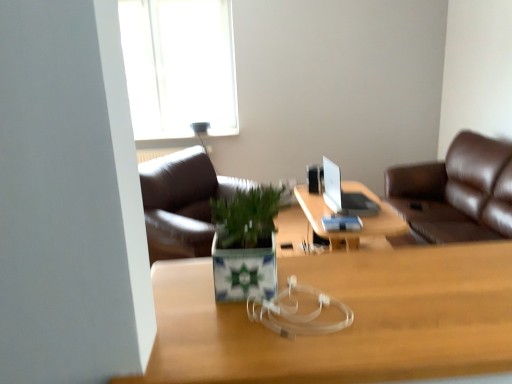
Question: Is wooden desk at center at the right side of green ceramic pot at center?

Choices:
 (A) no
 (B) yes

Answer: (B)

Question: Considering the relative sizes of wooden desk at center and green ceramic pot at center in the image provided, is wooden desk at center taller than green ceramic pot at center?

Choices:
 (A) yes
 (B) no

Answer: (B)

Question: From a real-world perspective, is wooden desk at center over green ceramic pot at center?

Choices:
 (A) no
 (B) yes

Answer: (A)

Question: Is wooden desk at center not inside green ceramic pot at center?

Choices:
 (A) yes
 (B) no

Answer: (A)

Question: Does wooden desk at center have a greater width compared to green ceramic pot at center?

Choices:
 (A) no
 (B) yes

Answer: (B)

Question: Does wooden desk at center have a lesser width compared to green ceramic pot at center?

Choices:
 (A) yes
 (B) no

Answer: (B)

Question: Is green ceramic pot at center touching wooden table at center?

Choices:
 (A) no
 (B) yes

Answer: (A)

Question: Is green ceramic pot at center located outside wooden table at center?

Choices:
 (A) no
 (B) yes

Answer: (B)

Question: Is green ceramic pot at center at the right side of wooden table at center?

Choices:
 (A) no
 (B) yes

Answer: (A)

Question: Does green ceramic pot at center turn towards wooden table at center?

Choices:
 (A) yes
 (B) no

Answer: (B)

Question: Is green ceramic pot at center facing away from wooden table at center?

Choices:
 (A) yes
 (B) no

Answer: (B)

Question: Does green ceramic pot at center come behind wooden table at center?

Choices:
 (A) yes
 (B) no

Answer: (B)

Question: From a real-world perspective, is wooden table at center physically above green ceramic pot at center?

Choices:
 (A) yes
 (B) no

Answer: (B)